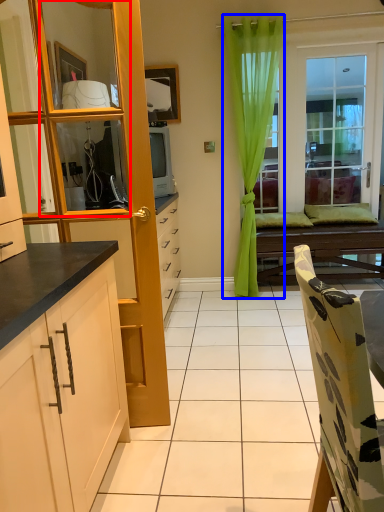
Question: Which point is closer to the camera, mirror (highlighted by a red box) or curtain (highlighted by a blue box)?

Choices:
 (A) mirror
 (B) curtain

Answer: (A)